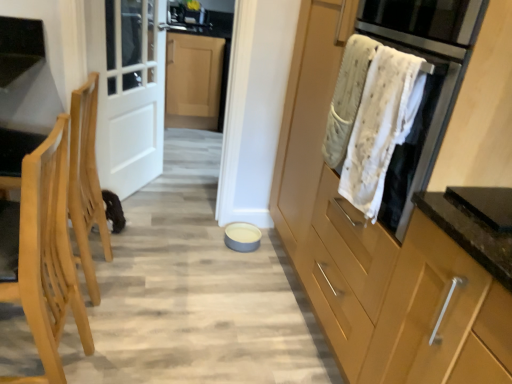
Question: Could clear glass door at upper left be considered to be inside white textured towel at upper right?

Choices:
 (A) yes
 (B) no

Answer: (B)

Question: From the image's perspective, is white textured towel at upper right located beneath clear glass door at upper left?

Choices:
 (A) no
 (B) yes

Answer: (B)

Question: Does white textured towel at upper right have a greater height compared to clear glass door at upper left?

Choices:
 (A) yes
 (B) no

Answer: (A)

Question: From the image's perspective, does white textured towel at upper right appear higher than clear glass door at upper left?

Choices:
 (A) yes
 (B) no

Answer: (B)

Question: Does white textured towel at upper right appear on the left side of clear glass door at upper left?

Choices:
 (A) yes
 (B) no

Answer: (B)

Question: Is white matte bowl at center wider or thinner than white wood door at left?

Choices:
 (A) thin
 (B) wide

Answer: (B)

Question: Is white matte bowl at center situated inside white wood door at left or outside?

Choices:
 (A) outside
 (B) inside

Answer: (A)

Question: From a real-world perspective, relative to white wood door at left, is white matte bowl at center vertically above or below?

Choices:
 (A) above
 (B) below

Answer: (B)

Question: Based on their positions, is white matte bowl at center located to the left or right of white wood door at left?

Choices:
 (A) right
 (B) left

Answer: (A)

Question: From the image's perspective, is clear glass door at upper left above or below white textured towel at upper right?

Choices:
 (A) above
 (B) below

Answer: (A)

Question: Is clear glass door at upper left wider or thinner than white textured towel at upper right?

Choices:
 (A) thin
 (B) wide

Answer: (B)

Question: From a real-world perspective, is clear glass door at upper left above or below white textured towel at upper right?

Choices:
 (A) above
 (B) below

Answer: (B)

Question: In the image, is clear glass door at upper left positioned in front of or behind white textured towel at upper right?

Choices:
 (A) front
 (B) behind

Answer: (B)

Question: Do you think clear glass door at upper left is within white matte bowl at center, or outside of it?

Choices:
 (A) inside
 (B) outside

Answer: (B)

Question: From a real-world perspective, is clear glass door at upper left positioned above or below white matte bowl at center?

Choices:
 (A) above
 (B) below

Answer: (A)